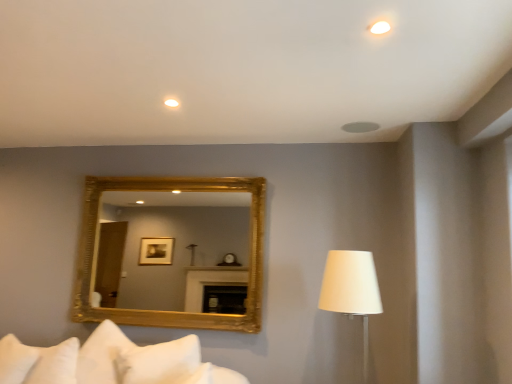
At what (x,y) coordinates should I click in order to perform the action: click on vacant space in front of white matte ceiling light at upper center, which is the second lighting from back to front. Please return your answer as a coordinate pair (x, y). Looking at the image, I should click on (388, 8).